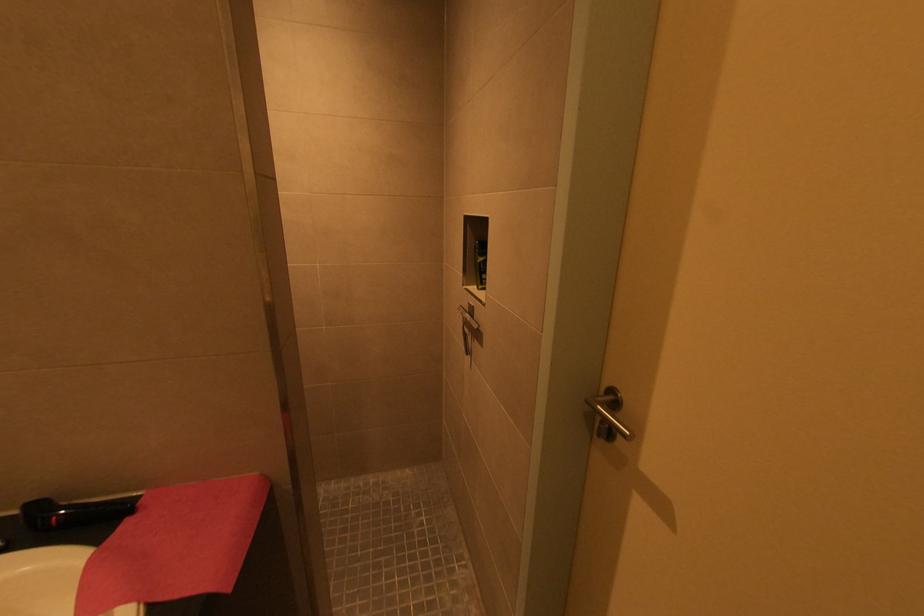
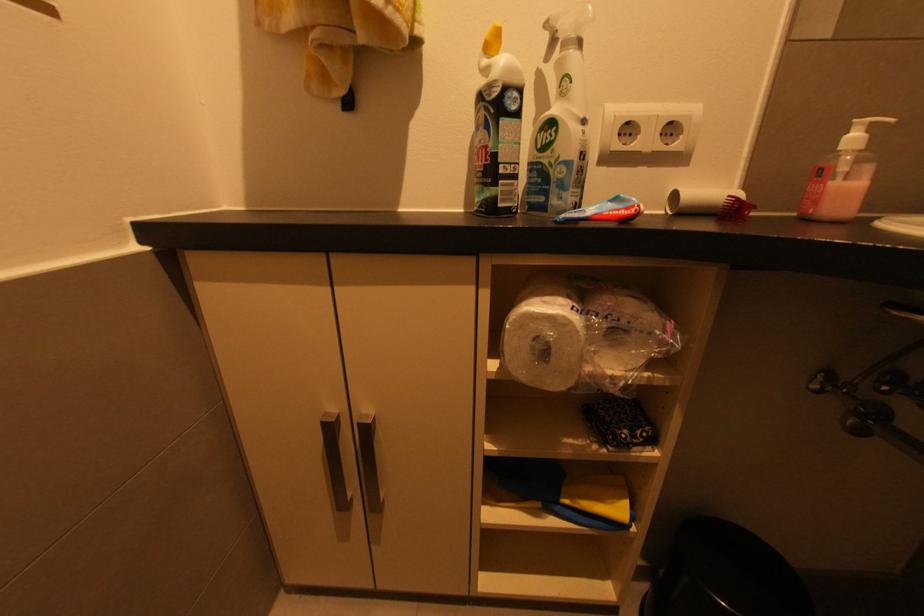
The first image is from the beginning of the video and the second image is from the end. How did the camera likely rotate when shooting the video?

The camera rotated toward left-down.